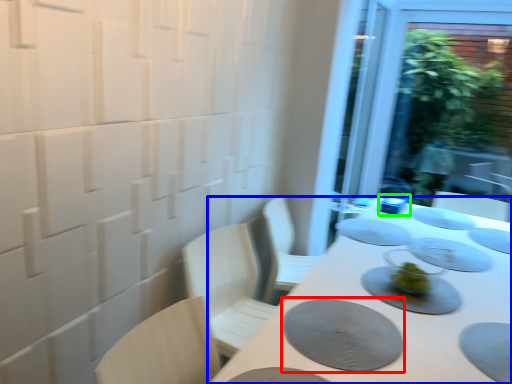
Question: Considering the real-world distances, which object is closest to platter (highlighted by a red box)? table (highlighted by a blue box) or tableware (highlighted by a green box).

Choices:
 (A) table
 (B) tableware

Answer: (A)